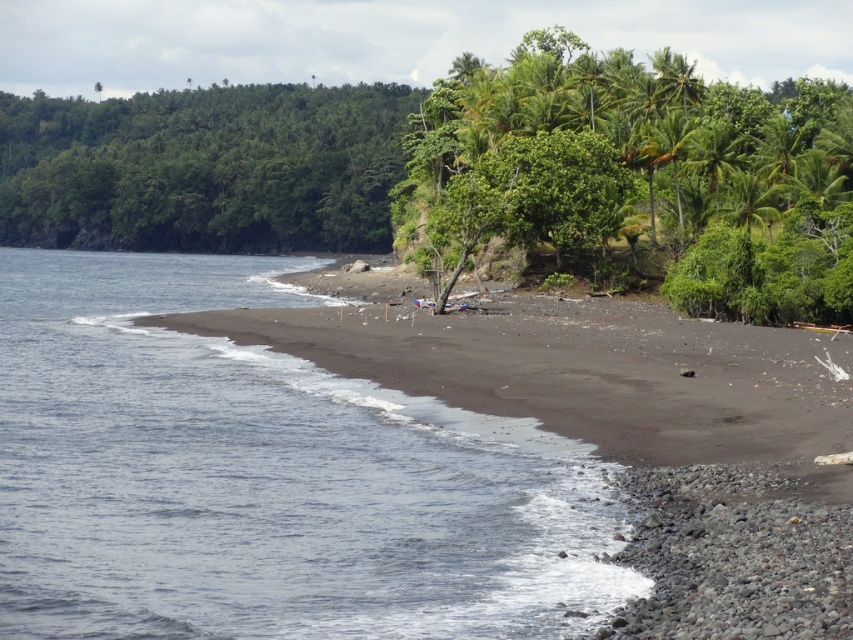
Question: Is green leafy trees at upper right to the left of green leafy trees at upper left from the viewer's perspective?

Choices:
 (A) no
 (B) yes

Answer: (A)

Question: Which object is the closest to the dark blue water at lower left?

Choices:
 (A) green leafy trees at upper left
 (B) green leafy trees at upper right

Answer: (B)

Question: In this image, where is dark blue water at lower left located relative to green leafy trees at upper left?

Choices:
 (A) below
 (B) above

Answer: (A)

Question: Estimate the real-world distances between objects in this image. Which object is farther from the green leafy trees at upper right?

Choices:
 (A) green leafy trees at upper left
 (B) dark blue water at lower left

Answer: (A)

Question: Is dark blue water at lower left further to camera compared to green leafy trees at upper left?

Choices:
 (A) no
 (B) yes

Answer: (A)

Question: Which of the following is the farthest from the observer?

Choices:
 (A) (276, 170)
 (B) (585, 83)
 (C) (368, 624)

Answer: (A)